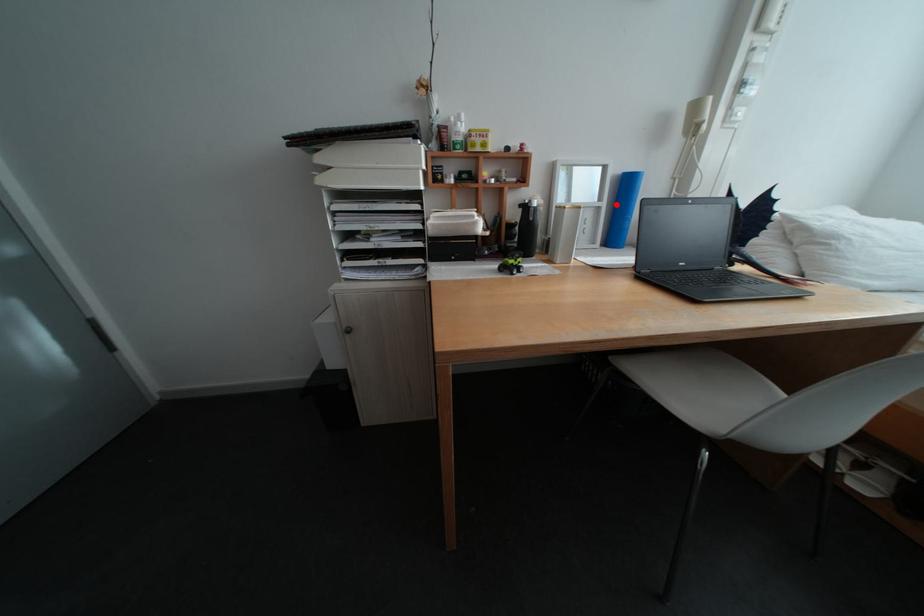
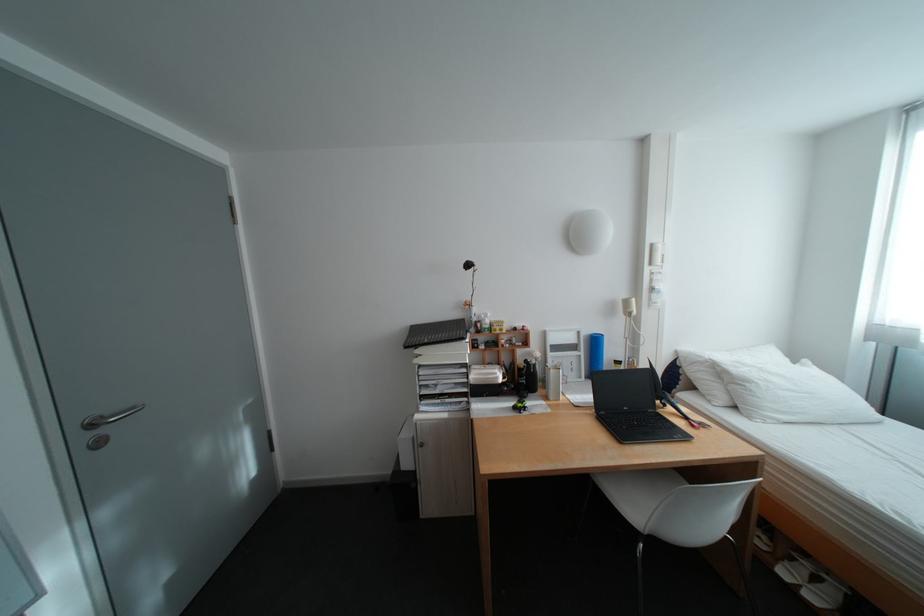
Question: I am providing you with two images of the same scene from different viewpoints. Image1 has a red point marked. In image2, the corresponding 3D location appears at what relative position? Reply with the corresponding letter.

Choices:
 (A) Closer
 (B) Farther

Answer: (B)